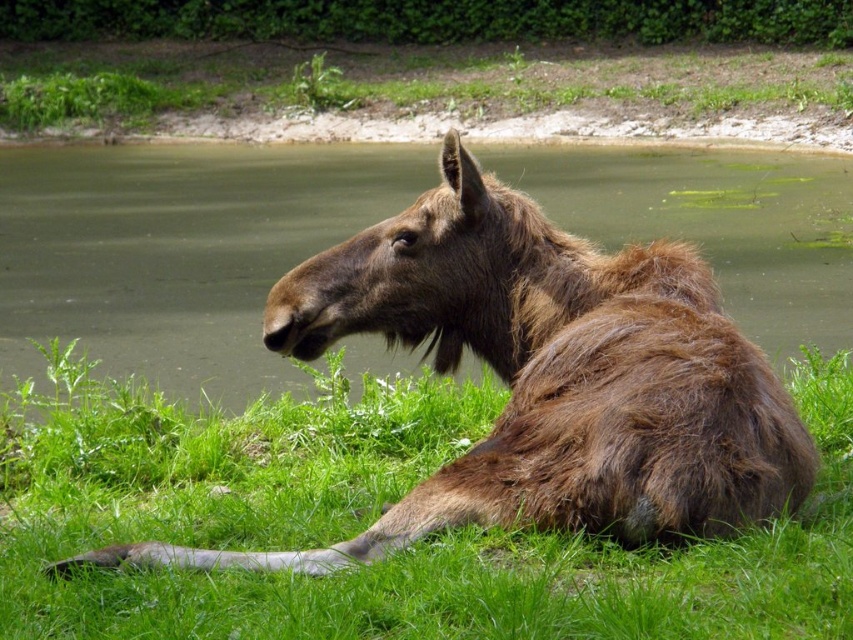
Which is behind, point (292, 595) or point (784, 64)?

Positioned behind is point (784, 64).

Is green soft grass at lower center to the right of green grass at upper center from the viewer's perspective?

Indeed, green soft grass at lower center is positioned on the right side of green grass at upper center.

Between point (1, 440) and point (386, 74), which one is positioned in front?

Point (1, 440)

Where is `green soft grass at lower center`? Image resolution: width=853 pixels, height=640 pixels. green soft grass at lower center is located at coordinates (373, 518).

Does brown furry moose at center appear under green grass at upper center?

Yes.

The height and width of the screenshot is (640, 853). Describe the element at coordinates (543, 378) in the screenshot. I see `brown furry moose at center` at that location.

At what (x,y) coordinates should I click in order to perform the action: click on brown furry moose at center. Please return your answer as a coordinate pair (x, y). Looking at the image, I should click on (543, 378).

Consider the image. Who is higher up, green soft grass at lower center or brown furry moose at center?

brown furry moose at center

Who is more distant from viewer, (x=93, y=429) or (x=393, y=538)?

The point (x=93, y=429) is behind.

In order to click on green soft grass at lower center in this screenshot , I will do `click(373, 518)`.

Find the location of a particular element. The width and height of the screenshot is (853, 640). green soft grass at lower center is located at coordinates (373, 518).